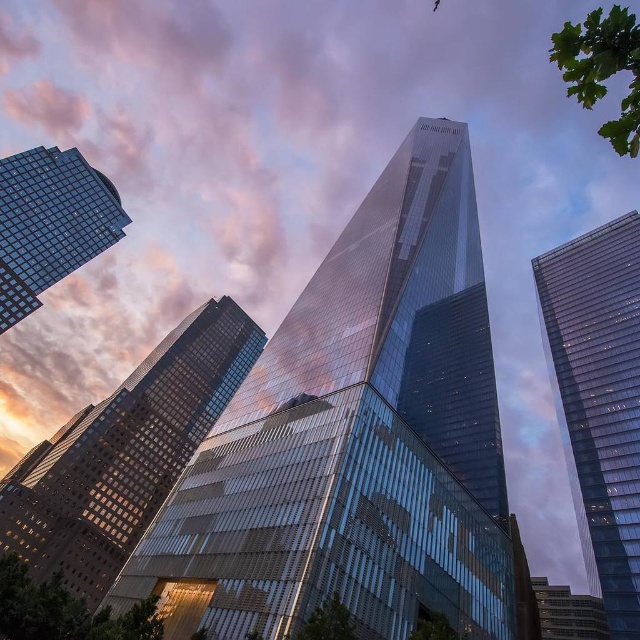
Who is positioned more to the left, transparent glass skyscraper at center or glassy reflective skyscraper at center?

glassy reflective skyscraper at center is more to the left.

Which is behind, point (333, 312) or point (180, 449)?

The point (180, 449) is more distant.

The image size is (640, 640). What do you see at coordinates (353, 436) in the screenshot?
I see `transparent glass skyscraper at center` at bounding box center [353, 436].

Where is `transparent glass skyscraper at center`? Image resolution: width=640 pixels, height=640 pixels. transparent glass skyscraper at center is located at coordinates (353, 436).

Who is positioned more to the right, transparent glass skyscraper at center or glassy reflective skyscraper at upper left?

transparent glass skyscraper at center is more to the right.

This screenshot has width=640, height=640. I want to click on transparent glass skyscraper at center, so click(x=353, y=436).

In order to click on transparent glass skyscraper at center in this screenshot , I will do `click(353, 436)`.

Does transparent glass skyscraper at center appear over glassy reflective skyscraper at lower right?

Yes, transparent glass skyscraper at center is above glassy reflective skyscraper at lower right.

Can you confirm if transparent glass skyscraper at center is taller than glassy reflective skyscraper at lower right?

In fact, transparent glass skyscraper at center may be shorter than glassy reflective skyscraper at lower right.

Find the location of a particular element. The height and width of the screenshot is (640, 640). transparent glass skyscraper at center is located at coordinates (353, 436).